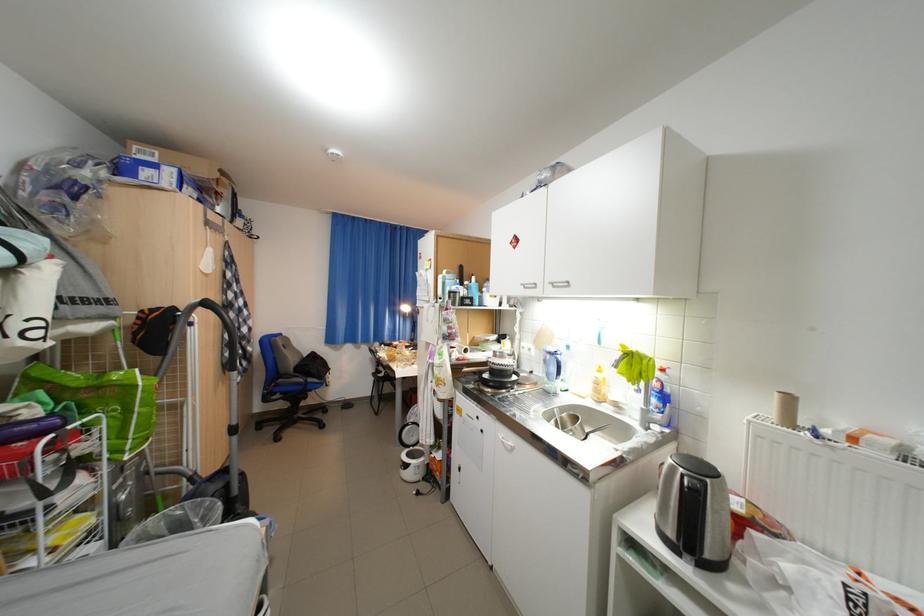
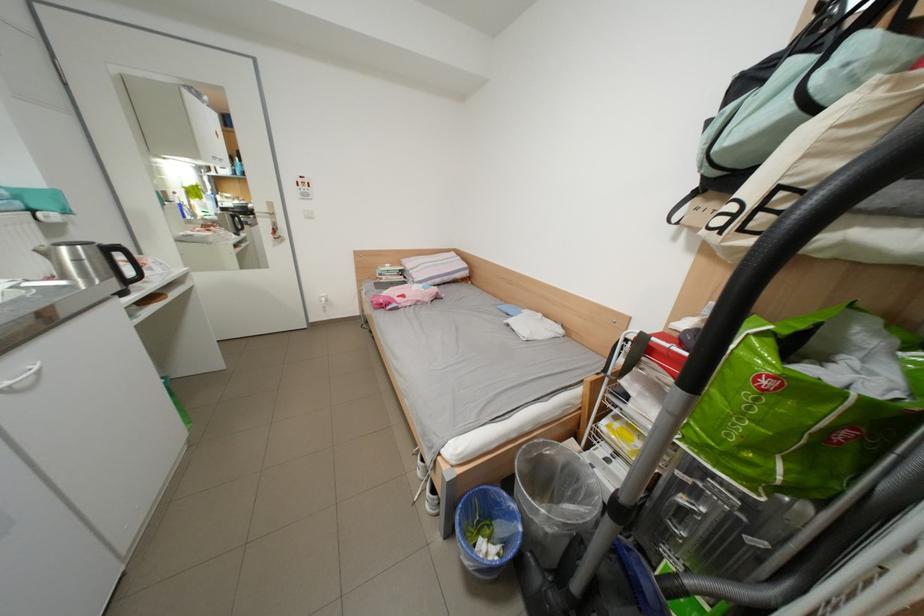
Question: I am providing you with two images of the same scene from different viewpoints. After the viewpoint changes to image2, which objects are now occluded?

Choices:
 (A) green shopping bag
 (B) black tote bag
 (C) black kettle handle
 (D) none of these

Answer: (D)